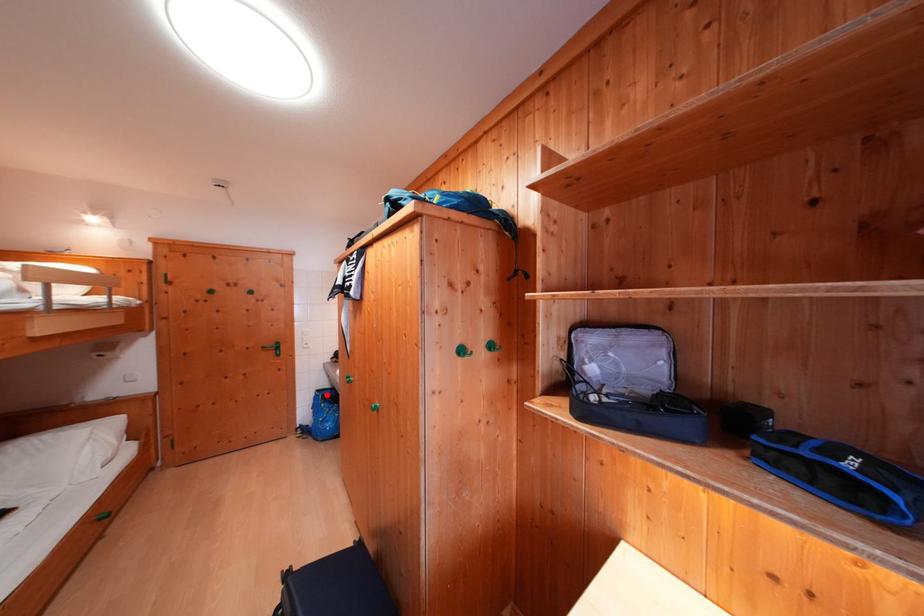
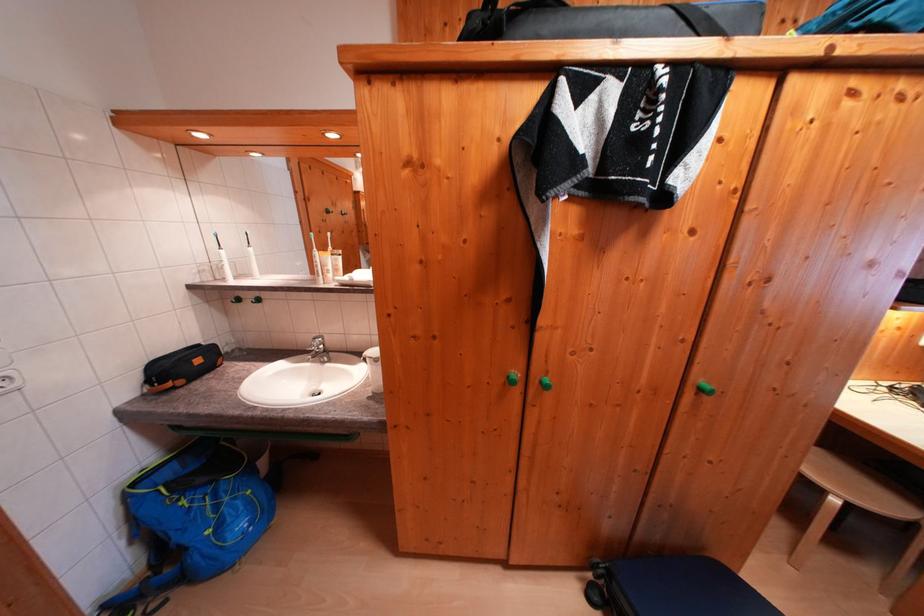
Question: I am providing you with two images of the same scene from different viewpoints. Given a red point in image1, look at the same physical point in image2. Is it:

Choices:
 (A) Closer to the viewpoint
 (B) Farther from the viewpoint

Answer: (A)